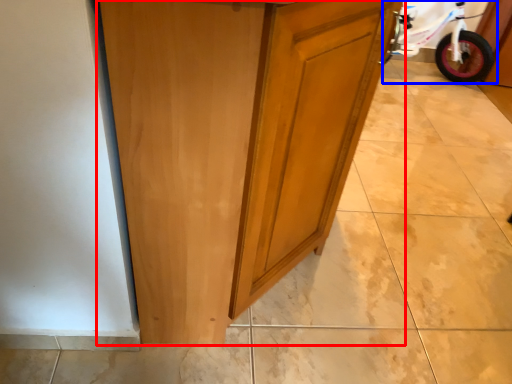
Question: Which point is closer to the camera, cupboard (highlighted by a red box) or bicycle (highlighted by a blue box)?

Choices:
 (A) cupboard
 (B) bicycle

Answer: (A)